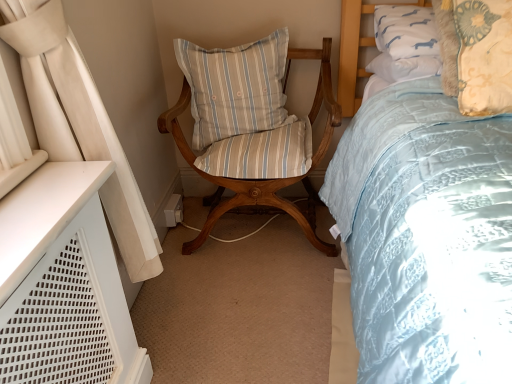
Question: Considering the relative sizes of floral-patterned fabric pillow at upper right, placed as the first pillow when sorted from front to back, and wooden chair with striped cushion at center in the image provided, is floral-patterned fabric pillow at upper right, placed as the first pillow when sorted from front to back, shorter than wooden chair with striped cushion at center?

Choices:
 (A) no
 (B) yes

Answer: (B)

Question: Is floral-patterned fabric pillow at upper right, which appears as the 2th pillow when viewed from the back, facing away from wooden chair with striped cushion at center?

Choices:
 (A) yes
 (B) no

Answer: (B)

Question: Considering the relative sizes of floral-patterned fabric pillow at upper right, the second pillow viewed from the left, and wooden chair with striped cushion at center in the image provided, is floral-patterned fabric pillow at upper right, the second pillow viewed from the left, taller than wooden chair with striped cushion at center?

Choices:
 (A) yes
 (B) no

Answer: (B)

Question: Does floral-patterned fabric pillow at upper right, the second pillow viewed from the left, come in front of wooden chair with striped cushion at center?

Choices:
 (A) yes
 (B) no

Answer: (A)

Question: From the image's perspective, is floral-patterned fabric pillow at upper right, arranged as the 1th pillow when viewed from the right, above wooden chair with striped cushion at center?

Choices:
 (A) no
 (B) yes

Answer: (B)

Question: From the image's perspective, is wooden chair with striped cushion at center located above or below light blue striped cushion at center, which is counted as the 1th pillow, starting from the back?

Choices:
 (A) below
 (B) above

Answer: (A)

Question: Is point (223, 114) closer or farther from the camera than point (198, 82)?

Choices:
 (A) closer
 (B) farther

Answer: (B)

Question: Considering the positions of wooden chair with striped cushion at center and light blue striped cushion at center, acting as the second pillow starting from the front, in the image, is wooden chair with striped cushion at center wider or thinner than light blue striped cushion at center, acting as the second pillow starting from the front,?

Choices:
 (A) thin
 (B) wide

Answer: (B)

Question: Is wooden chair with striped cushion at center inside or outside of light blue striped cushion at center, acting as the second pillow starting from the front?

Choices:
 (A) inside
 (B) outside

Answer: (B)

Question: Considering their positions, is light blue striped cushion at center, the first pillow positioned from the left, located in front of or behind floral-patterned fabric pillow at upper right, which appears as the 2th pillow when viewed from the back?

Choices:
 (A) behind
 (B) front

Answer: (A)

Question: From their relative heights in the image, would you say light blue striped cushion at center, which is counted as the 1th pillow, starting from the back, is taller or shorter than floral-patterned fabric pillow at upper right, which appears as the 2th pillow when viewed from the back?

Choices:
 (A) tall
 (B) short

Answer: (A)

Question: From the image's perspective, is light blue striped cushion at center, which is counted as the 1th pillow, starting from the back, located above or below floral-patterned fabric pillow at upper right, the second pillow viewed from the left?

Choices:
 (A) below
 (B) above

Answer: (B)

Question: Considering the relative positions of light blue striped cushion at center, arranged as the second pillow when viewed from the right, and floral-patterned fabric pillow at upper right, arranged as the 1th pillow when viewed from the right, in the image provided, is light blue striped cushion at center, arranged as the second pillow when viewed from the right, to the left or to the right of floral-patterned fabric pillow at upper right, arranged as the 1th pillow when viewed from the right,?

Choices:
 (A) right
 (B) left

Answer: (B)

Question: Considering their positions, is light blue striped cushion at center, which is counted as the 1th pillow, starting from the back, located in front of or behind wooden chair with striped cushion at center?

Choices:
 (A) behind
 (B) front

Answer: (A)

Question: Choose the correct answer: Is light blue striped cushion at center, arranged as the second pillow when viewed from the right, inside wooden chair with striped cushion at center or outside it?

Choices:
 (A) outside
 (B) inside

Answer: (B)